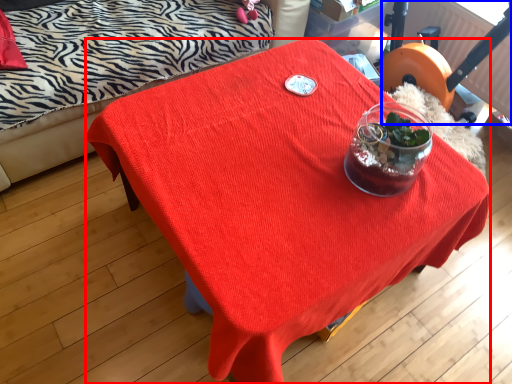
Question: Which object appears closest to the camera in this image, desk (highlighted by a red box) or swivel chair (highlighted by a blue box)?

Choices:
 (A) desk
 (B) swivel chair

Answer: (A)